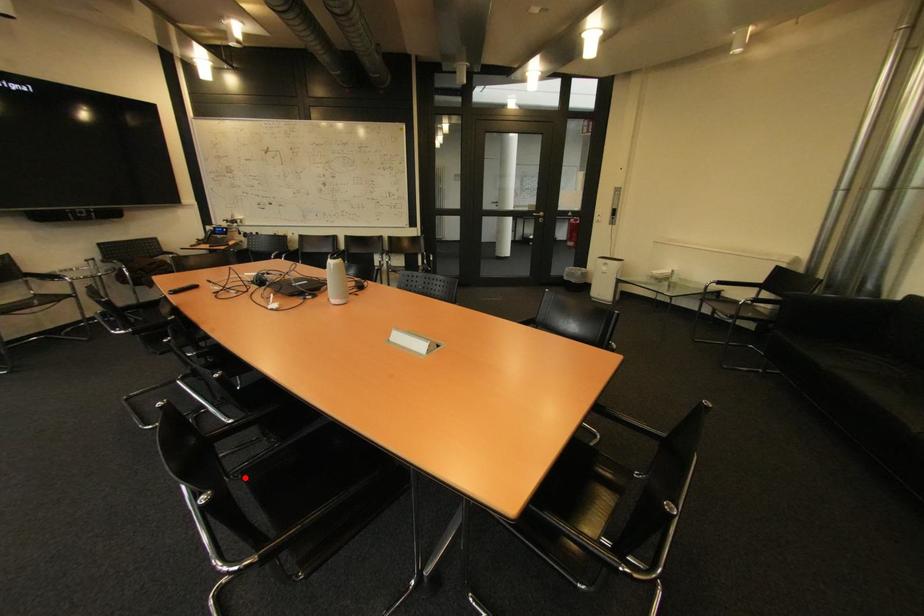
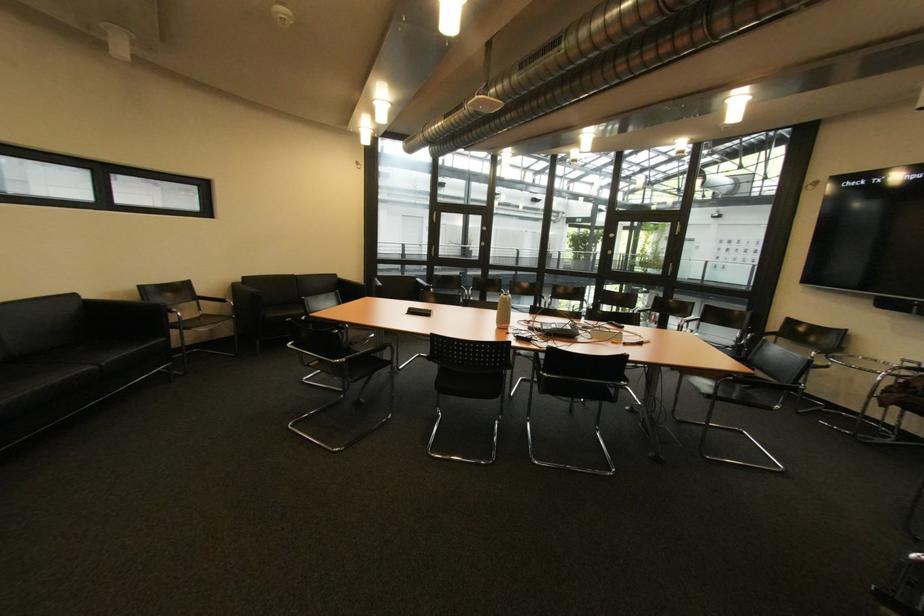
Question: I am providing you with two images of the same scene from different viewpoints. A red point is marked on the first image. Can you still see the location of the red point in image 2?

Choices:
 (A) Yes
 (B) No

Answer: (B)